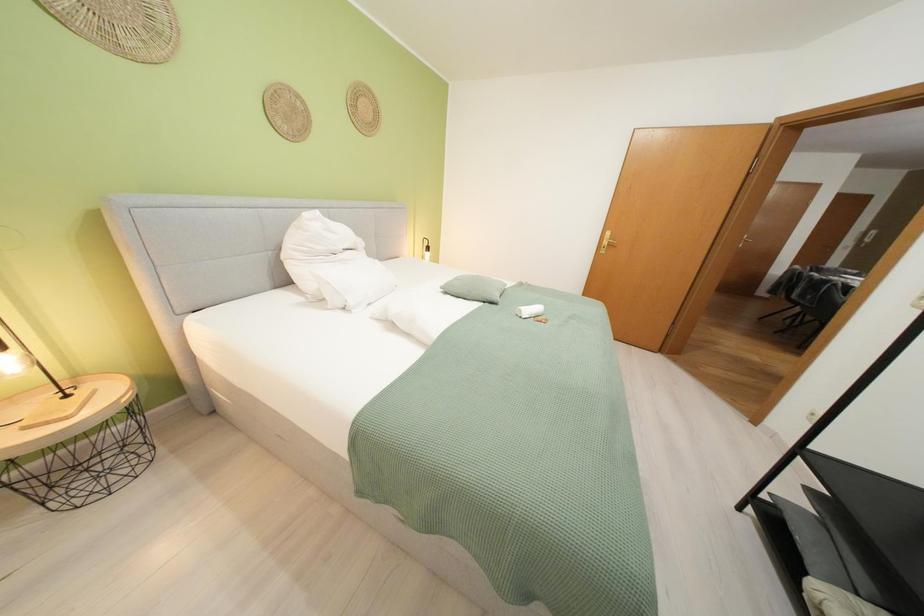
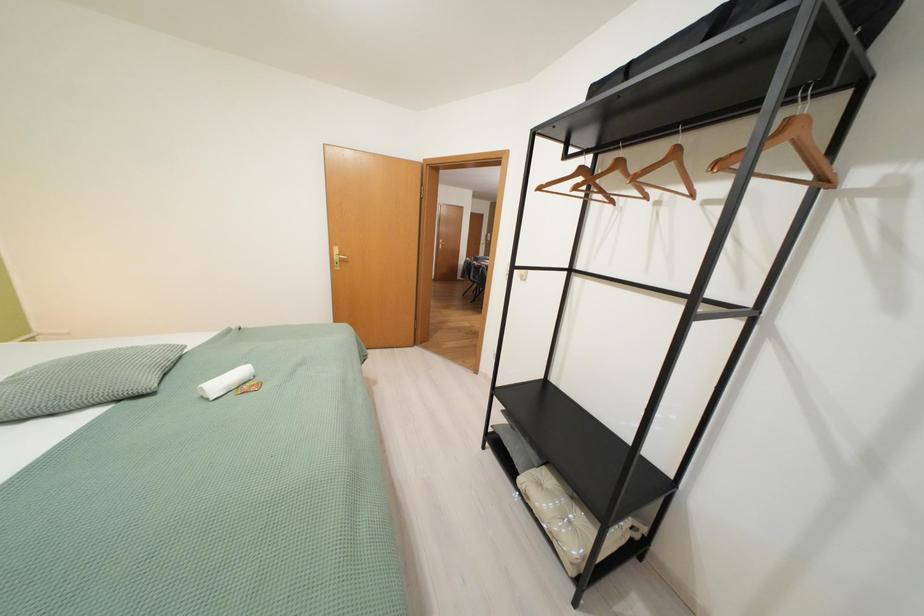
Question: The camera is either moving clockwise (left) or counter-clockwise (right) around the object. The first image is from the beginning of the video and the second image is from the end. Is the camera moving left or right when shooting the video?

Choices:
 (A) Left
 (B) Right

Answer: (A)